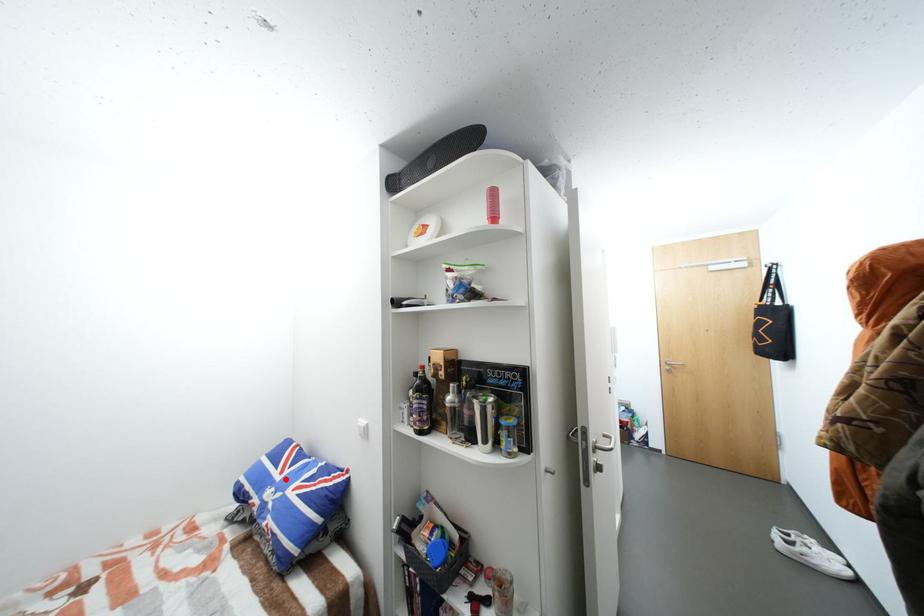
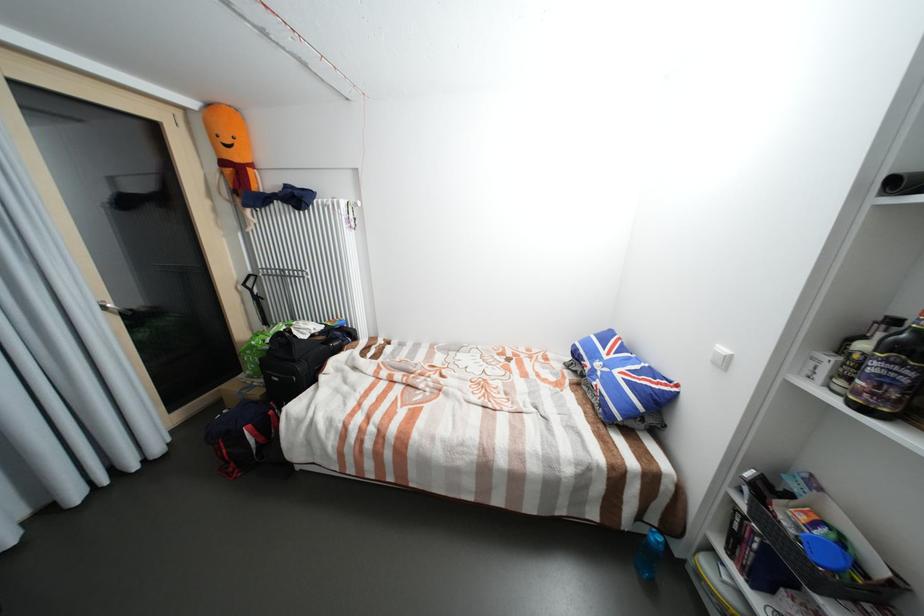
Locate, in the second image, the point that corresponds to the highlighted location in the first image.

(613, 358)